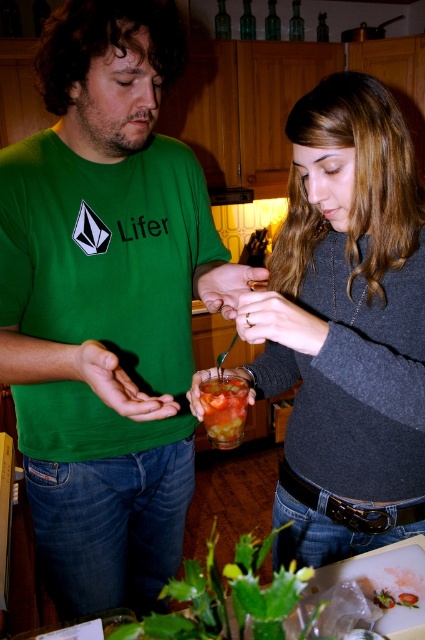
Can you confirm if tomato soup at center is positioned above strawberry jam jar at center?

Yes.

Who is lower down, tomato soup at center or strawberry jam jar at center?

strawberry jam jar at center is below.

Which is behind, point (210, 394) or point (402, 598)?

The point (402, 598) is behind.

You are a GUI agent. You are given a task and a screenshot of the screen. Output one action in this format:
    pyautogui.click(x=<x>, y=<y>)
    Task: Click on the tomato soup at center
    The width and height of the screenshot is (425, 640).
    Given the screenshot: What is the action you would take?
    pyautogui.click(x=223, y=408)

Can you confirm if green t-shirt at center is positioned to the right of tomato soup at center?

Incorrect, green t-shirt at center is not on the right side of tomato soup at center.

Is green t-shirt at center wider than tomato soup at center?

Correct, the width of green t-shirt at center exceeds that of tomato soup at center.

Measure the distance between point (176, 368) and camera.

1.11 meters

Image resolution: width=425 pixels, height=640 pixels. Identify the location of green t-shirt at center. (107, 305).

Is matte gray sweater at center closer to camera compared to strawberry jam jar at center?

Yes, matte gray sweater at center is closer to the viewer.

Which is more to the right, matte gray sweater at center or strawberry jam jar at center?

Positioned to the right is strawberry jam jar at center.

I want to click on matte gray sweater at center, so click(x=345, y=326).

The height and width of the screenshot is (640, 425). Identify the location of matte gray sweater at center. (345, 326).